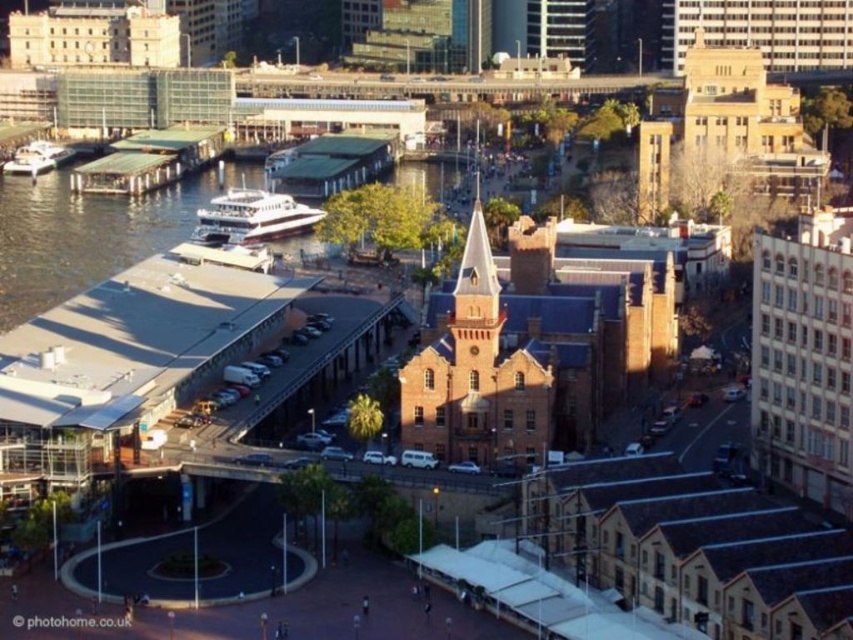
Question: Which point is closer to the camera taking this photo?

Choices:
 (A) (24, 161)
 (B) (291, 211)

Answer: (B)

Question: Can you confirm if white glossy ferry at upper left is thinner than white glossy boat at left?

Choices:
 (A) yes
 (B) no

Answer: (B)

Question: Which of the following is the closest to the observer?

Choices:
 (A) (32, 147)
 (B) (236, 227)

Answer: (B)

Question: Is white glossy ferry at upper left closer to camera compared to white glossy boat at left?

Choices:
 (A) yes
 (B) no

Answer: (A)

Question: Does white glossy ferry at upper left have a smaller size compared to white glossy boat at left?

Choices:
 (A) no
 (B) yes

Answer: (A)